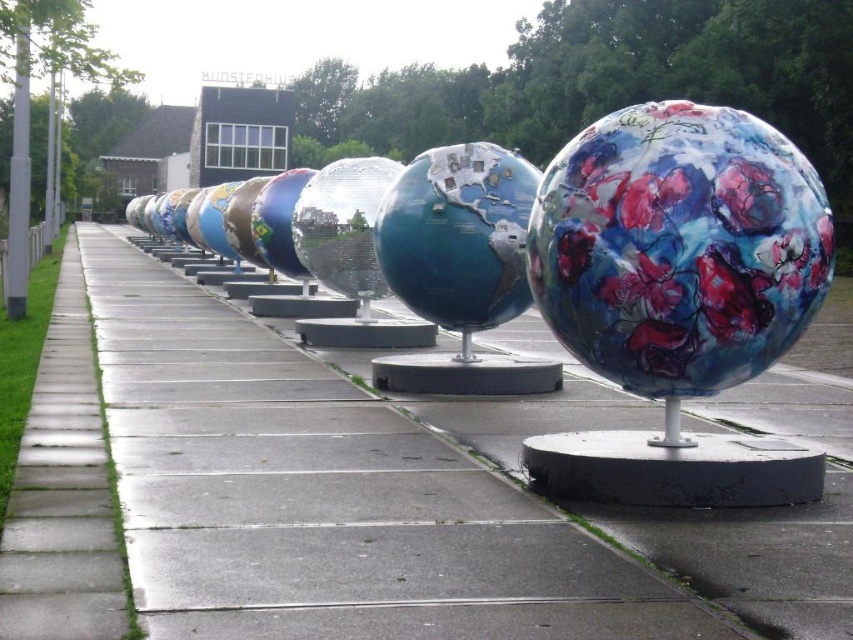
Question: Does concrete at center appear on the right side of floral painted sphere at center?

Choices:
 (A) no
 (B) yes

Answer: (A)

Question: Does concrete at center appear over floral painted sphere at center?

Choices:
 (A) yes
 (B) no

Answer: (B)

Question: From the image, what is the correct spatial relationship of concrete at center in relation to floral painted sphere at center?

Choices:
 (A) below
 (B) above

Answer: (A)